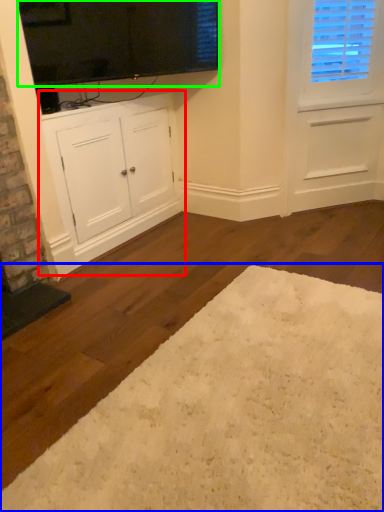
Question: Which is farther away from cabinetry (highlighted by a red box)? plain (highlighted by a blue box) or window screen (highlighted by a green box)?

Choices:
 (A) plain
 (B) window screen

Answer: (A)